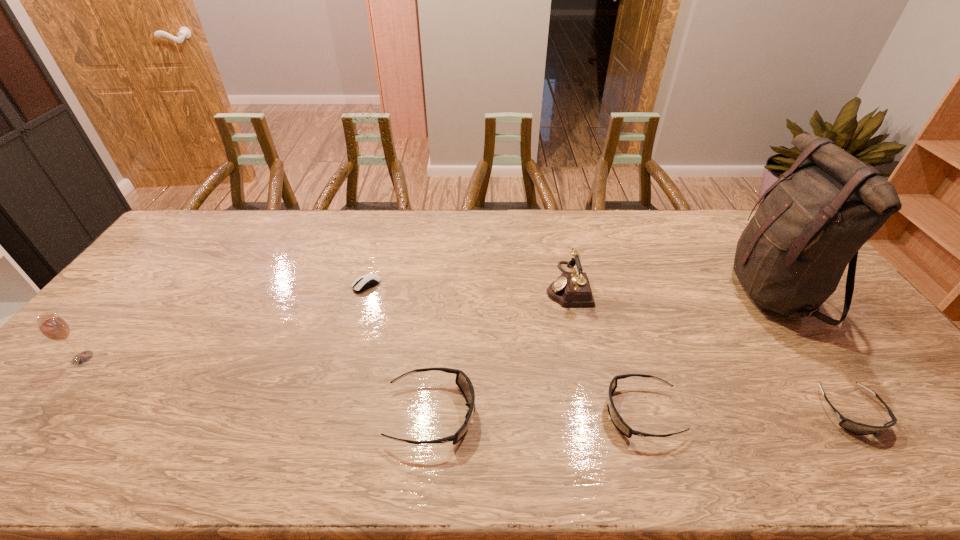
This screenshot has height=540, width=960. In order to click on the fourth shortest object in this screenshot , I will do `click(462, 380)`.

You are a GUI agent. You are given a task and a screenshot of the screen. Output one action in this format:
    pyautogui.click(x=<x>, y=<y>)
    Task: Click on the third object from left to right
    This screenshot has height=540, width=960.
    Given the screenshot: What is the action you would take?
    pyautogui.click(x=462, y=380)

Find the location of a particular element. the fifth tallest object is located at coordinates (617, 420).

I want to click on the second tallest goggles, so click(x=617, y=420).

Locate an element on the screen. This screenshot has width=960, height=540. the rightmost goggles is located at coordinates (857, 428).

This screenshot has width=960, height=540. I want to click on the shortest goggles, so pos(857,428).

Identify the location of mouse. The height and width of the screenshot is (540, 960). (367, 281).

The width and height of the screenshot is (960, 540). What are the coordinates of `the shortest object` in the screenshot? It's located at (367, 281).

I want to click on telephone, so click(x=571, y=289).

You are a GUI agent. You are given a task and a screenshot of the screen. Output one action in this format:
    pyautogui.click(x=<x>, y=<y>)
    Task: Click on the backpack
    
    Given the screenshot: What is the action you would take?
    pyautogui.click(x=790, y=258)